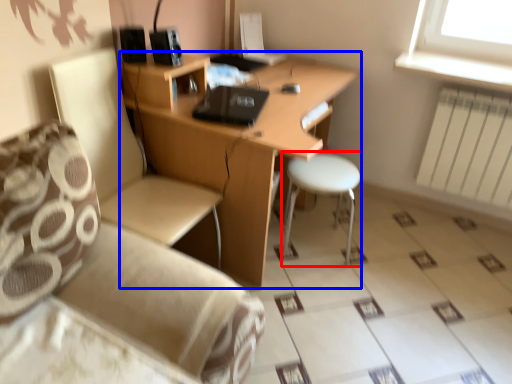
Question: Which point is closer to the camera, bar stool (highlighted by a red box) or desk (highlighted by a blue box)?

Choices:
 (A) bar stool
 (B) desk

Answer: (B)